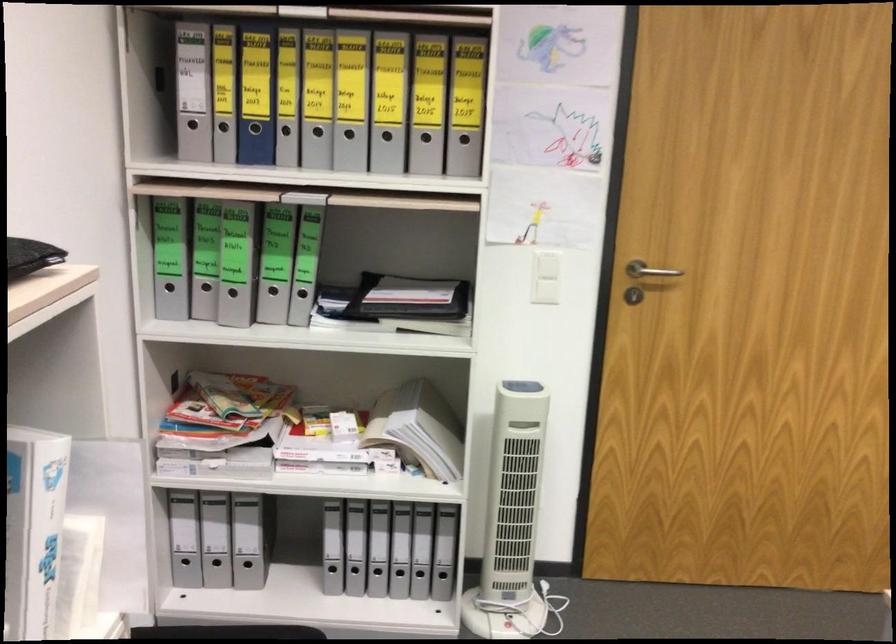
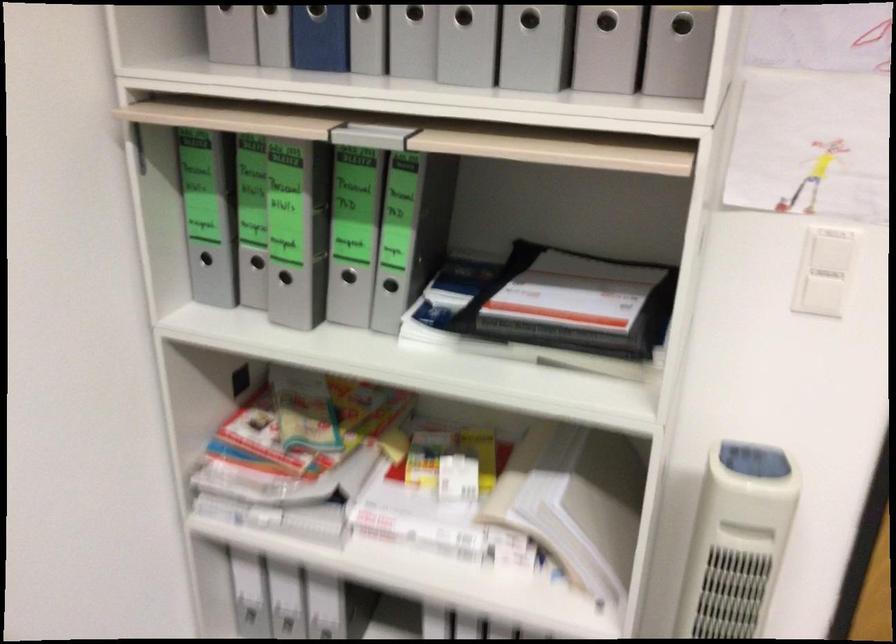
Where in the second image is the point corresponding to (x=431, y=134) from the first image?

(606, 21)